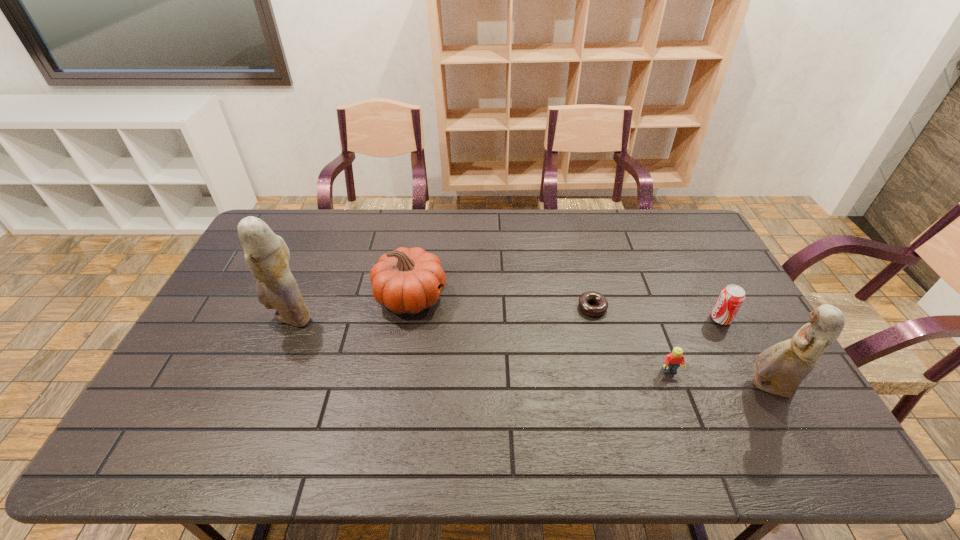
The image size is (960, 540). I want to click on vacant space located 0.090m on the face of the Lego, so click(683, 407).

This screenshot has width=960, height=540. Identify the location of object present at the near edge. (780, 369).

What are the coordinates of `figurine positioned at the right edge` in the screenshot? It's located at (780, 369).

You are a GUI agent. You are given a task and a screenshot of the screen. Output one action in this format:
    pyautogui.click(x=<x>, y=<y>)
    Task: Click on the soda can that is at the right edge
    
    Given the screenshot: What is the action you would take?
    pyautogui.click(x=731, y=298)

Where is `object present at the near right corner`? This screenshot has height=540, width=960. object present at the near right corner is located at coordinates (780, 369).

This screenshot has width=960, height=540. Find the location of `vacant area at the far edge of the desktop`. vacant area at the far edge of the desktop is located at coordinates (363, 231).

I want to click on free location at the near edge of the desktop, so click(215, 418).

Locate an element on the screen. vacant space at the left edge is located at coordinates (243, 341).

This screenshot has width=960, height=540. Identify the location of vacant region at the right edge. (714, 284).

This screenshot has width=960, height=540. Identify the location of vacant space at the far right corner. (665, 238).